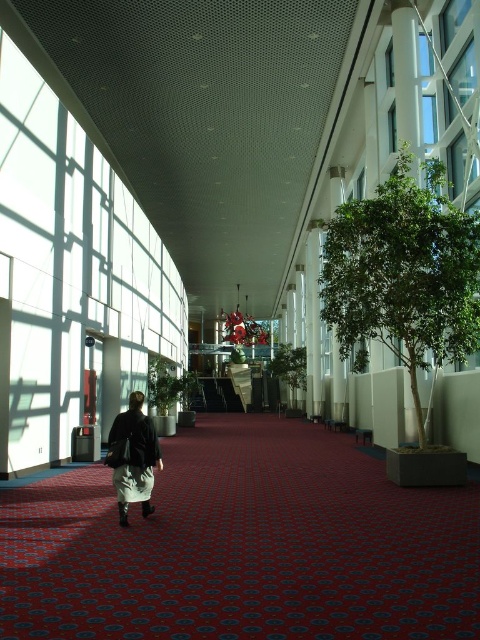
Between dark brown leather jacket at center and green leafy tree at center, which one appears on the right side from the viewer's perspective?

From the viewer's perspective, green leafy tree at center appears more on the right side.

Is point (152, 454) more distant than point (300, 348)?

No.

This screenshot has width=480, height=640. In order to click on dark brown leather jacket at center in this screenshot , I will do `click(132, 458)`.

Which is above, green leafy tree at right or green leafy tree at center?

Positioned higher is green leafy tree at right.

Does green leafy tree at right have a lesser width compared to green leafy tree at center?

Indeed, green leafy tree at right has a lesser width compared to green leafy tree at center.

Which is in front, point (468, 273) or point (301, 374)?

Positioned in front is point (468, 273).

Locate an element on the screen. This screenshot has height=640, width=480. green leafy tree at right is located at coordinates (404, 273).

Where is `green leafy tree at right`? The image size is (480, 640). green leafy tree at right is located at coordinates (404, 273).

Which is more to the left, green leafy tree at right or dark brown leather jacket at center?

Positioned to the left is dark brown leather jacket at center.

Which is in front, point (443, 259) or point (119, 483)?

Point (119, 483) is in front.

The width and height of the screenshot is (480, 640). I want to click on green leafy tree at right, so click(404, 273).